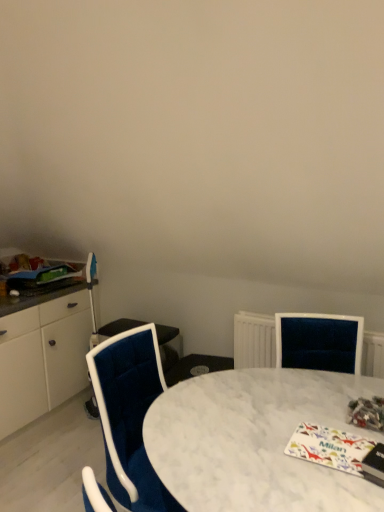
The image size is (384, 512). What are the coordinates of `vacant location behind white glossy magazine at lower right, the 2th magazine when ordered from left to right` in the screenshot? It's located at click(x=302, y=411).